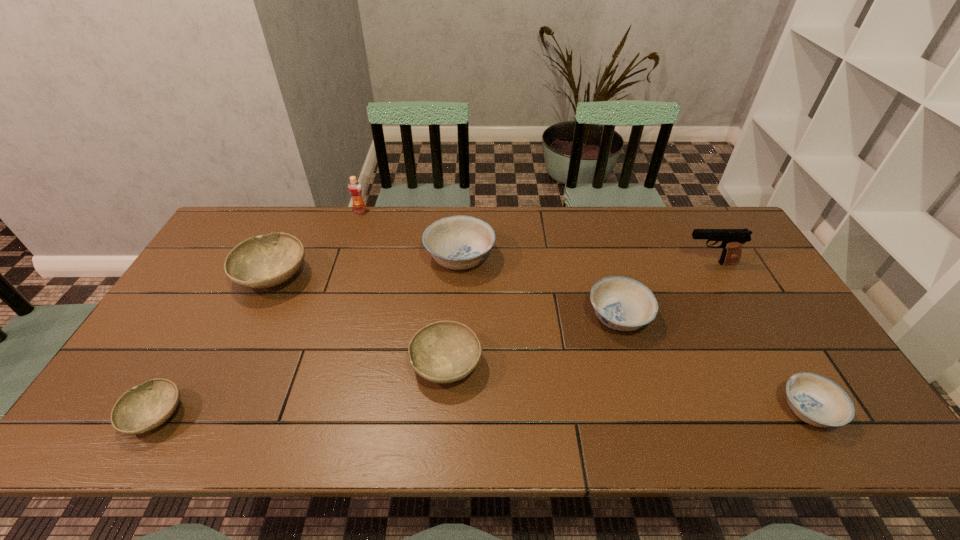
Image resolution: width=960 pixels, height=540 pixels. I want to click on orange juice, so click(354, 187).

Identify the location of the third object from left to right. The image size is (960, 540). pos(354,187).

Identify the location of black pistol. This screenshot has height=540, width=960. (732, 240).

The width and height of the screenshot is (960, 540). Identify the location of the farthest blue bowl. (459, 242).

Find the location of a particular element. the leftmost blue bowl is located at coordinates (459, 242).

Where is `the farthest gray bowl`? the farthest gray bowl is located at coordinates (264, 261).

Where is `the sixth object from left to right`? The height and width of the screenshot is (540, 960). the sixth object from left to right is located at coordinates (621, 303).

Where is `the second blue bowl from left to right`? This screenshot has width=960, height=540. the second blue bowl from left to right is located at coordinates (621, 303).

Locate an element on the screen. the second biggest gray bowl is located at coordinates (442, 352).

You are a GUI agent. You are given a task and a screenshot of the screen. Output one action in this format:
    pyautogui.click(x=<x>, y=<y>)
    Task: Click on the rightmost blue bowl
    This screenshot has height=540, width=960.
    Given the screenshot: What is the action you would take?
    pyautogui.click(x=818, y=401)